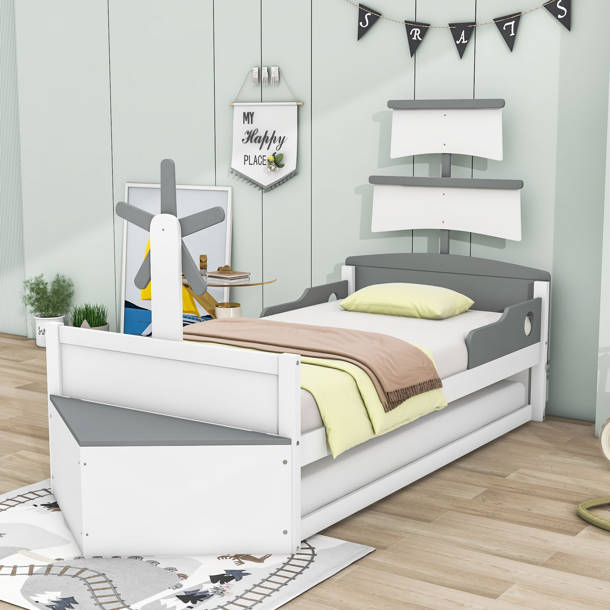
Where is `laminate floor`? The height and width of the screenshot is (610, 610). laminate floor is located at coordinates click(x=492, y=518).